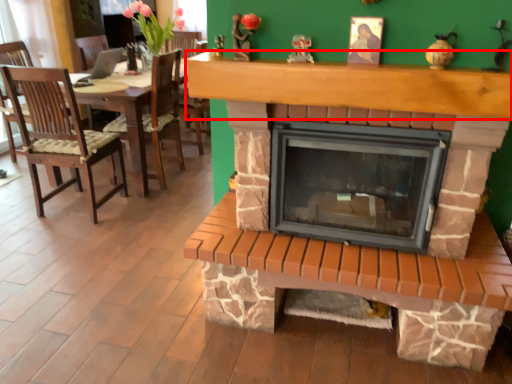
Question: From the image's perspective, considering the relative positions of mantle (annotated by the red box) and wood burning stove in the image provided, where is mantle (annotated by the red box) located with respect to the staircase?

Choices:
 (A) above
 (B) below

Answer: (A)